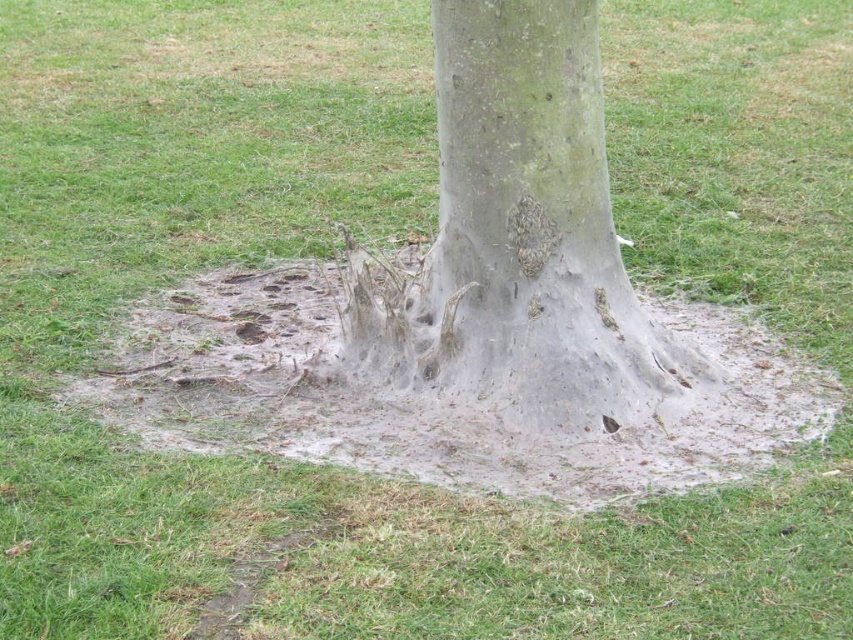
Is white sandy mud at center below gray rough bark at center?

Yes, white sandy mud at center is below gray rough bark at center.

How distant is white sandy mud at center from gray rough bark at center?

white sandy mud at center and gray rough bark at center are 14.10 inches apart from each other.

Is point (270, 342) closer to camera compared to point (519, 177)?

No, it is not.

You are a GUI agent. You are given a task and a screenshot of the screen. Output one action in this format:
    pyautogui.click(x=<x>, y=<y>)
    Task: Click on the white sandy mud at center
    The image size is (853, 640).
    Given the screenshot: What is the action you would take?
    pyautogui.click(x=450, y=392)